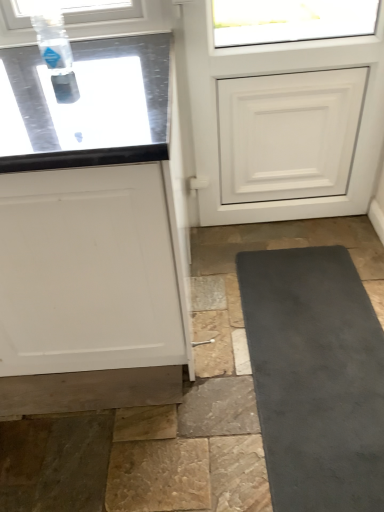
At what (x,y) coordinates should I click in order to perform the action: click on transparent plastic bottle at upper left. Please return your answer as a coordinate pair (x, y). Looking at the image, I should click on (53, 42).

From the image's perspective, is white matte cabinet at left located above or below transparent plastic bottle at upper left?

white matte cabinet at left is below transparent plastic bottle at upper left.

Considering the relative sizes of white matte cabinet at left and transparent plastic bottle at upper left in the image provided, is white matte cabinet at left taller than transparent plastic bottle at upper left?

Indeed, white matte cabinet at left has a greater height compared to transparent plastic bottle at upper left.

In the scene shown: Which is more to the right, white matte cabinet at left or transparent plastic bottle at upper left?

From the viewer's perspective, transparent plastic bottle at upper left appears more on the right side.

From a real-world perspective, which object rests below the other?

white matte cabinet at left is physically lower.

From a real-world perspective, which object stands above the other?

In real-world perspective, transparent plastic bottle at upper left is above.

From the image's perspective, is transparent plastic bottle at upper left below white matte cabinet at left?

Actually, transparent plastic bottle at upper left appears above white matte cabinet at left in the image.

From the image's perspective, who appears lower, white matte cabinet at left or white matte door at upper center?

white matte cabinet at left.

Is white matte cabinet at left not close to white matte door at upper center?

No.

Does white matte cabinet at left appear on the right side of white matte door at upper center?

No.

Is white matte door at upper center a part of white matte cabinet at left?

No, white matte door at upper center is not inside white matte cabinet at left.

From a real-world perspective, which is physically above, white matte door at upper center or transparent plastic bottle at upper left?

From a 3D spatial view, transparent plastic bottle at upper left is above.

Is point (283, 55) more distant than point (54, 12)?

Yes, point (283, 55) is farther from viewer.

Which of these two, white matte door at upper center or transparent plastic bottle at upper left, is bigger?

With larger size is white matte door at upper center.

Are white matte door at upper center and transparent plastic bottle at upper left located far from each other?

No.

Which is behind, point (43, 45) or point (325, 7)?

The point (325, 7) is farther.

From a real-world perspective, is transparent plastic bottle at upper left positioned above or below white matte door at upper center?

From a real-world perspective, transparent plastic bottle at upper left is physically above white matte door at upper center.

Can you see transparent plastic bottle at upper left touching white matte door at upper center?

transparent plastic bottle at upper left and white matte door at upper center are clearly separated.

From the image's perspective, is transparent plastic bottle at upper left below white matte door at upper center?

Incorrect, from the image's perspective, transparent plastic bottle at upper left is higher than white matte door at upper center.

Considering the sizes of objects white matte door at upper center and white matte cabinet at left in the image provided, who is thinner, white matte door at upper center or white matte cabinet at left?

With smaller width is white matte door at upper center.

From the image's perspective, between white matte door at upper center and white matte cabinet at left, who is located below?

white matte cabinet at left.

Does point (186, 60) come behind point (142, 194)?

Yes, point (186, 60) is behind point (142, 194).

Which of these two, white matte door at upper center or white matte cabinet at left, stands taller?

Standing taller between the two is white matte door at upper center.

You are a GUI agent. You are given a task and a screenshot of the screen. Output one action in this format:
    pyautogui.click(x=<x>, y=<y>)
    Task: Click on the cabinetry that is in front of the transparent plastic bottle at upper left
    Image resolution: width=384 pixels, height=512 pixels.
    Given the screenshot: What is the action you would take?
    pyautogui.click(x=89, y=234)

Where is `cabinetry to the left of transparent plastic bottle at upper left`? Image resolution: width=384 pixels, height=512 pixels. cabinetry to the left of transparent plastic bottle at upper left is located at coordinates (89, 234).

From the image, which object appears to be farther from transparent plastic bottle at upper left, white matte cabinet at left or white matte door at upper center?

white matte door at upper center lies further to transparent plastic bottle at upper left than the other object.

Based on their spatial positions, is white matte door at upper center or transparent plastic bottle at upper left further from white matte cabinet at left?

The object further to white matte cabinet at left is white matte door at upper center.

When comparing their distances from white matte cabinet at left, does transparent plastic bottle at upper left or white matte door at upper center seem further?

white matte door at upper center is further to white matte cabinet at left.

Based on their spatial positions, is white matte cabinet at left or transparent plastic bottle at upper left further from white matte door at upper center?

Among the two, transparent plastic bottle at upper left is located further to white matte door at upper center.

Consider the image. From the image, which object appears to be farther from transparent plastic bottle at upper left, white matte door at upper center or white matte cabinet at left?

white matte door at upper center is further to transparent plastic bottle at upper left.

Which object lies nearer to the anchor point white matte door at upper center, transparent plastic bottle at upper left or white matte cabinet at left?

white matte cabinet at left is positioned closer to the anchor white matte door at upper center.

Locate an element on the screen. bottle located between white matte cabinet at left and white matte door at upper center in the left-right direction is located at coordinates (53, 42).